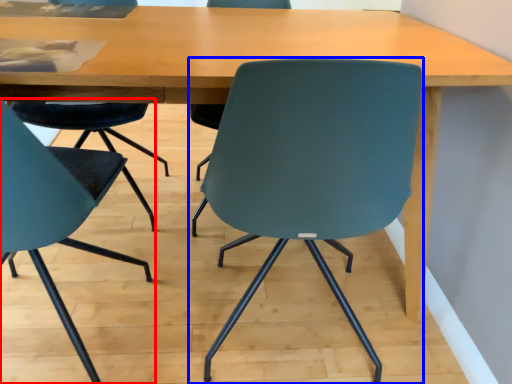
Question: Which of the following is the closest to the observer, chair (highlighted by a red box) or chair (highlighted by a blue box)?

Choices:
 (A) chair
 (B) chair

Answer: (A)